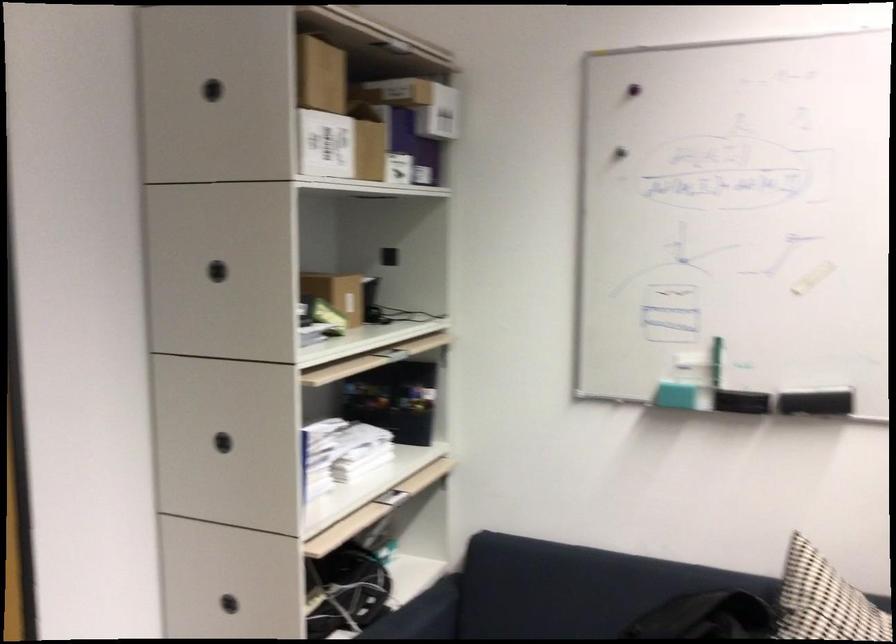
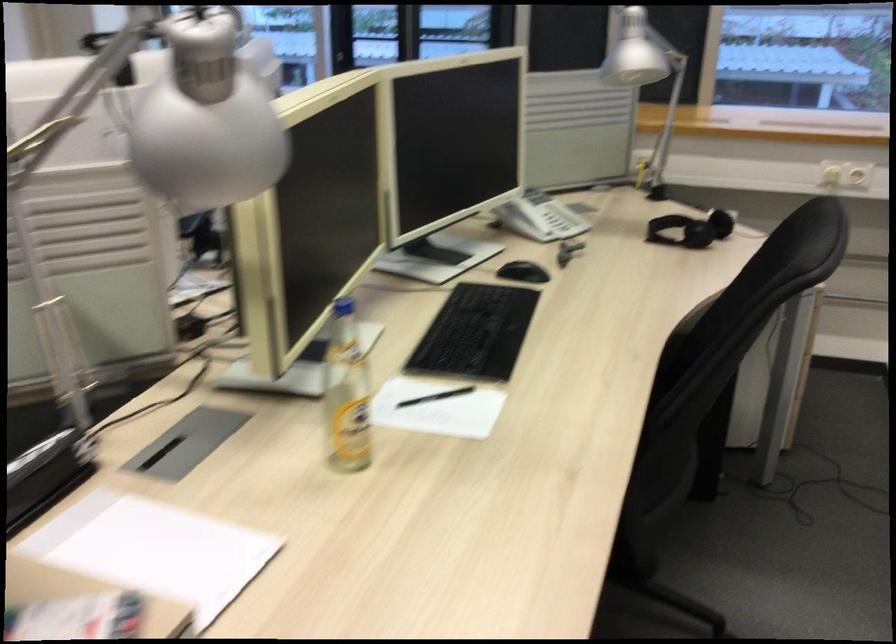
How did the camera likely rotate?

The camera's rotation is toward right-down.